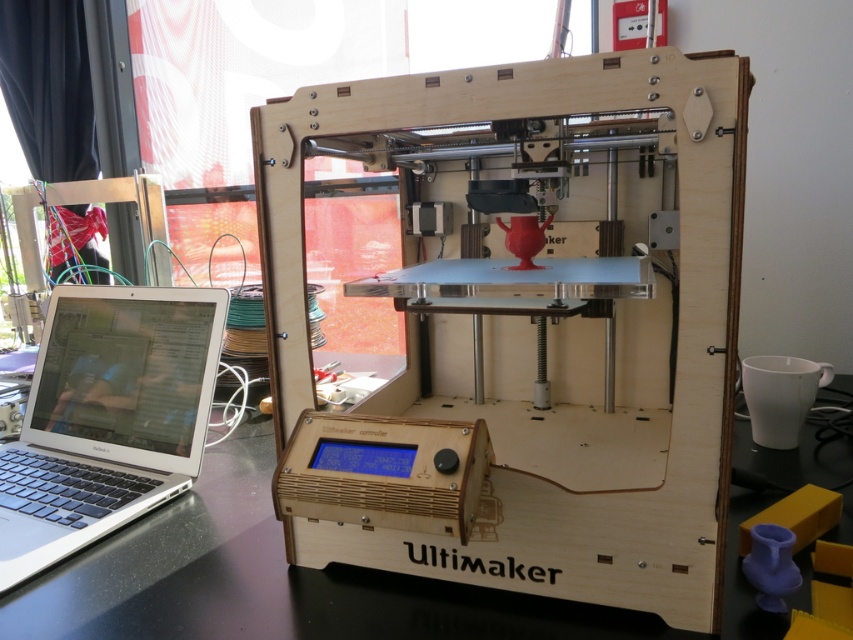
Is wooden ultimaker 3d printer at center thinner than black glossy table at lower left?

Yes, wooden ultimaker 3d printer at center is thinner than black glossy table at lower left.

Can you confirm if wooden ultimaker 3d printer at center is positioned to the left of black glossy table at lower left?

Yes, wooden ultimaker 3d printer at center is to the left of black glossy table at lower left.

The height and width of the screenshot is (640, 853). Describe the element at coordinates (525, 330) in the screenshot. I see `wooden ultimaker 3d printer at center` at that location.

Locate an element on the screen. The width and height of the screenshot is (853, 640). wooden ultimaker 3d printer at center is located at coordinates [x=525, y=330].

Is point (592, 616) positioned behind point (49, 502)?

That is False.

Which is behind, point (440, 600) or point (155, 440)?

The point (155, 440) is more distant.

Where is `black glossy table at lower left`? black glossy table at lower left is located at coordinates (270, 580).

This screenshot has width=853, height=640. What do you see at coordinates (525, 330) in the screenshot?
I see `wooden ultimaker 3d printer at center` at bounding box center [525, 330].

Is wooden ultimaker 3d printer at center wider than silver metallic laptop at left?

Yes.

Is point (532, 218) positioned in front of point (22, 506)?

Yes, it is in front of point (22, 506).

Where is `wooden ultimaker 3d printer at center`? The width and height of the screenshot is (853, 640). wooden ultimaker 3d printer at center is located at coordinates (525, 330).